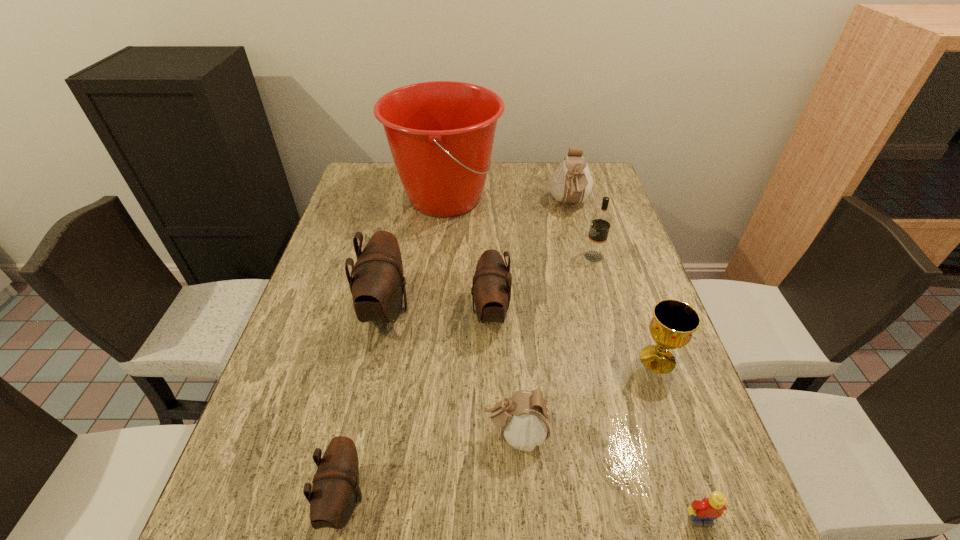
You are a GUI agent. You are given a task and a screenshot of the screen. Output one action in this format:
    pyautogui.click(x=<x>, y=<y>)
    Task: Click on the yellow Lego
    The image size is (960, 540).
    Given the screenshot: What is the action you would take?
    pyautogui.click(x=703, y=512)

The width and height of the screenshot is (960, 540). In order to click on the shortest object in this screenshot , I will do `click(703, 512)`.

Locate an element on the screen. This screenshot has width=960, height=540. free space located with the handle attached to the rim of the red bucket is located at coordinates (594, 198).

This screenshot has height=540, width=960. In order to click on free space located 0.220m with the flap open on the biggest brown pouch in this screenshot , I will do `click(498, 309)`.

Find the location of `free region located 0.370m on the label of the vodka`. free region located 0.370m on the label of the vodka is located at coordinates [x=452, y=256].

Where is `vacant space located 0.200m on the label of the vodka`? This screenshot has height=540, width=960. vacant space located 0.200m on the label of the vodka is located at coordinates (512, 256).

Locate an element on the screen. This screenshot has width=960, height=540. free region located 0.330m on the label of the vodka is located at coordinates (467, 256).

Where is `free space located 0.150m on the front-facing side of the farthest pouch`? free space located 0.150m on the front-facing side of the farthest pouch is located at coordinates (581, 249).

Locate an element on the screen. The height and width of the screenshot is (540, 960). free location located 0.340m with the flap open on the second biggest brown pouch is located at coordinates (334, 312).

Find the location of a particular element. Image resolution: width=960 pixels, height=540 pixels. vacant space located 0.330m with the flap open on the second biggest brown pouch is located at coordinates pos(338,312).